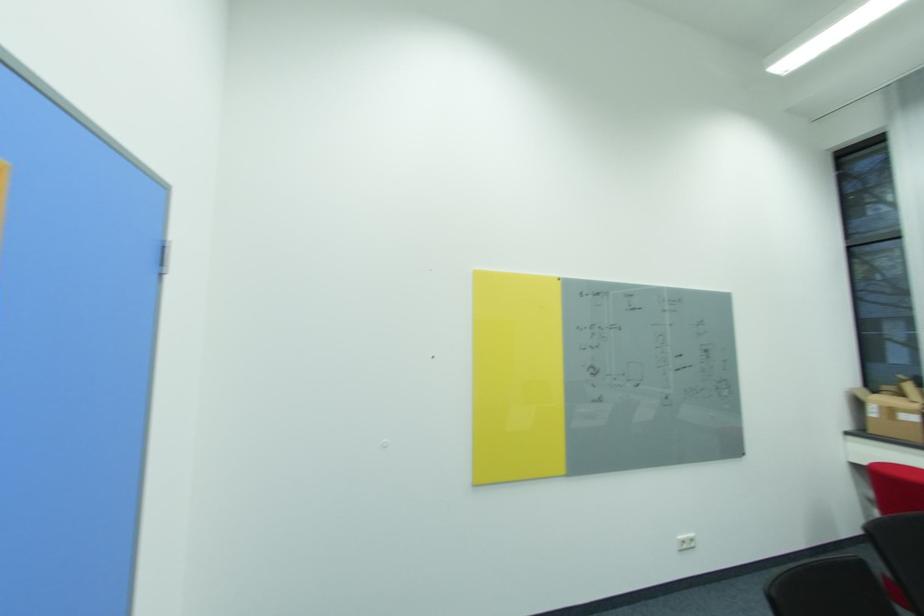
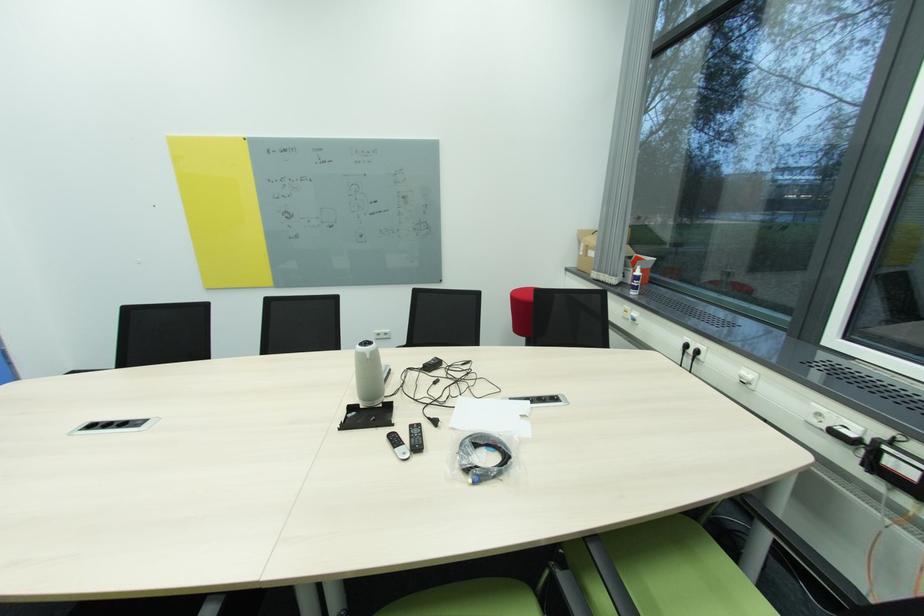
Question: In a continuous first-person perspective shot, in which direction is the camera moving?

Choices:
 (A) Left
 (B) Right
 (C) Forward
 (D) Backward

Answer: (B)